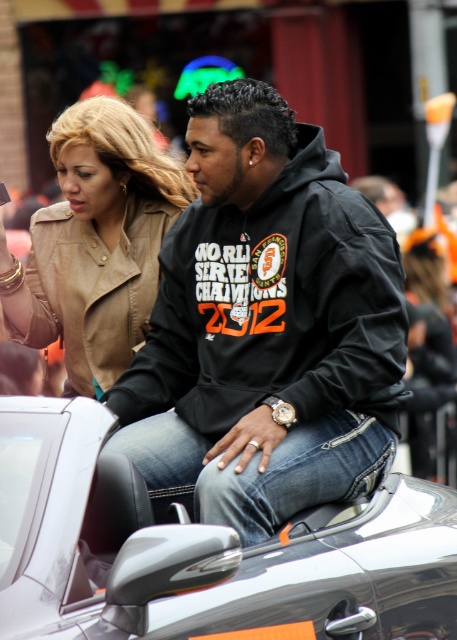
Based on the photo, who is shorter, shiny silver convertible at center or leather jacket at center?

With less height is shiny silver convertible at center.

Is shiny silver convertible at center thinner than leather jacket at center?

No, shiny silver convertible at center is not thinner than leather jacket at center.

The image size is (457, 640). I want to click on shiny silver convertible at center, so click(x=205, y=550).

Looking at this image, which is more to the right, black hoodie at center or leather jacket at center?

From the viewer's perspective, black hoodie at center appears more on the right side.

Which is behind, point (240, 435) or point (95, 193)?

Positioned behind is point (95, 193).

Find the location of `black hoodie at center`. black hoodie at center is located at coordinates (266, 326).

Who is more distant from viewer, (x=355, y=276) or (x=382, y=480)?

Positioned behind is point (x=355, y=276).

This screenshot has height=640, width=457. I want to click on black hoodie at center, so click(266, 326).